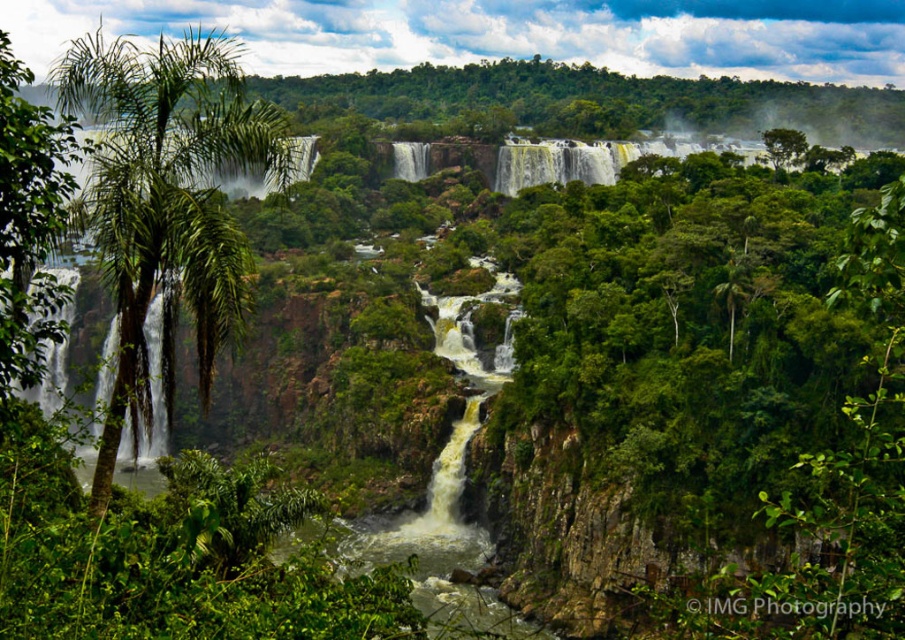
You are standing at the center of the image looking at the tropical landscape with cascading waterfalls. Where is the green leafy palm tree at left located in terms of coordinates?

The green leafy palm tree at left is located at coordinates point (167, 200).

You are standing in the tropical landscape and want to take a photo of the cascading waterfalls. There are two green leafy trees on your left side. Which tree is closer to you, the green leafy palm tree at left or the green leafy tree at left?

The green leafy palm tree at left is positioned over the green leafy tree at left, so the green leafy palm tree at left is closer to you.